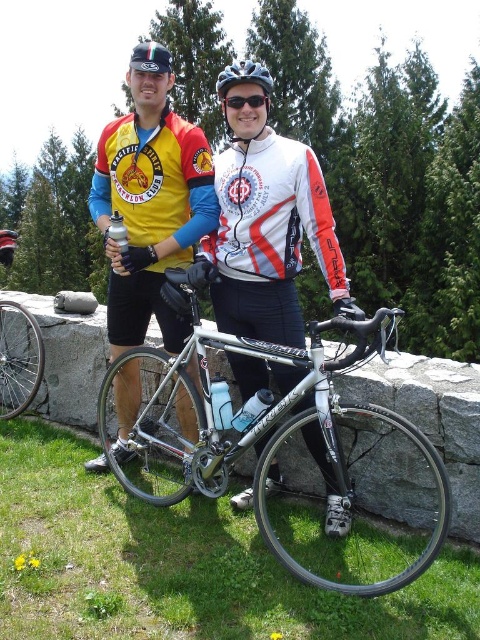
You are a photographer setting up a shot of the two cyclists and their bicycles. You need to ensure that the matte black bicycle at center and the silver metallic bicycle wheel at left are both in focus. Given that your camera can only focus on objects taller than 1.2 meters, will both bicycles meet the focus requirement?

The matte black bicycle at center has a greater height compared to silver metallic bicycle wheel at left. Since the camera requires objects taller than 1.2 meters to be in focus, the matte black bicycle at center likely meets the requirement. However, the silver metallic bicycle wheel at left may not be tall enough unless its height also exceeds 1.2 meters. Without specific measurements for the wheel, we can only confirm the bicycle meets the requirement.

You are a photographer trying to capture a clear shot of the silver metallic bicycle wheel at left and the black matte goggles at center. Which object is located to the right of the other?

The black matte goggles at center are located to the right of the silver metallic bicycle wheel at left.